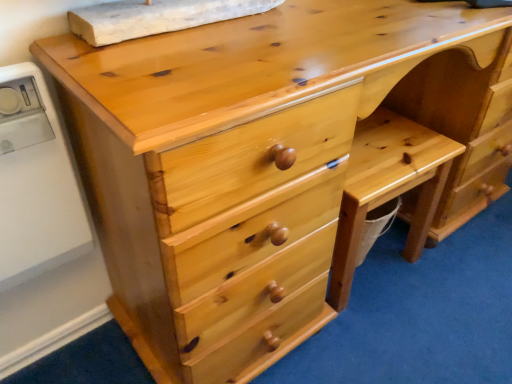
Question: Can you confirm if white plastic appliance at left is positioned to the right of natural wood chair at lower right?

Choices:
 (A) yes
 (B) no

Answer: (B)

Question: Considering the relative sizes of white plastic appliance at left and natural wood chair at lower right in the image provided, is white plastic appliance at left thinner than natural wood chair at lower right?

Choices:
 (A) no
 (B) yes

Answer: (B)

Question: Can you confirm if white plastic appliance at left is smaller than natural wood chair at lower right?

Choices:
 (A) yes
 (B) no

Answer: (A)

Question: From the image's perspective, is white plastic appliance at left located above natural wood chair at lower right?

Choices:
 (A) no
 (B) yes

Answer: (B)

Question: Can you confirm if white plastic appliance at left is shorter than natural wood chair at lower right?

Choices:
 (A) no
 (B) yes

Answer: (A)

Question: Is the position of white plastic appliance at left more distant than that of natural wood chair at lower right?

Choices:
 (A) no
 (B) yes

Answer: (A)

Question: Can you confirm if natural wood chair at lower right is taller than white plastic appliance at left?

Choices:
 (A) no
 (B) yes

Answer: (A)

Question: Can you confirm if natural wood chair at lower right is positioned to the right of white plastic appliance at left?

Choices:
 (A) yes
 (B) no

Answer: (A)

Question: Can you confirm if natural wood chair at lower right is positioned to the left of white plastic appliance at left?

Choices:
 (A) yes
 (B) no

Answer: (B)

Question: From the image's perspective, is natural wood chair at lower right over white plastic appliance at left?

Choices:
 (A) no
 (B) yes

Answer: (A)

Question: Is natural wood chair at lower right smaller than white plastic appliance at left?

Choices:
 (A) yes
 (B) no

Answer: (B)

Question: Can we say natural wood chair at lower right lies outside white plastic appliance at left?

Choices:
 (A) yes
 (B) no

Answer: (A)

Question: Choose the correct answer: Is natural wood chair at lower right inside white plastic appliance at left or outside it?

Choices:
 (A) outside
 (B) inside

Answer: (A)